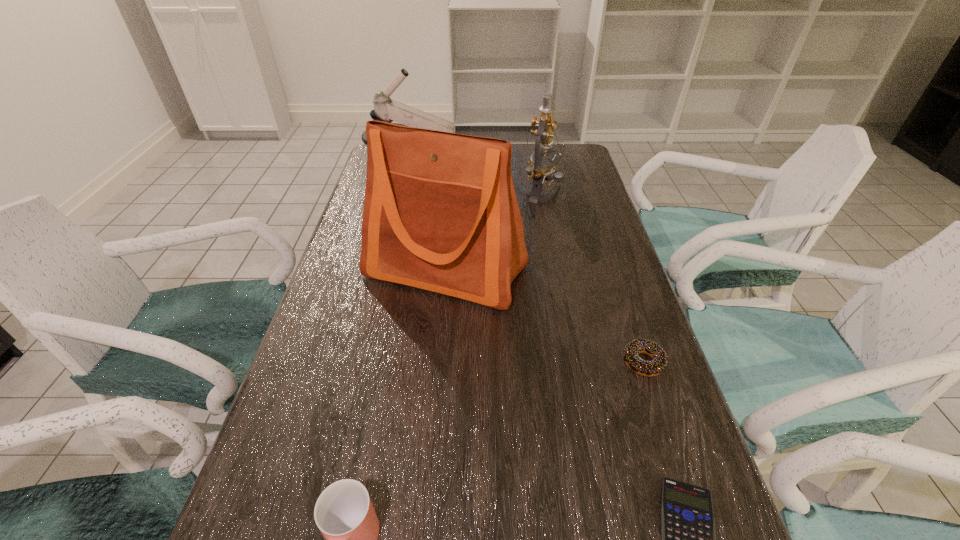
Find the location of a particular element. The image size is (960, 540). shopping bag located at the left edge is located at coordinates (440, 213).

Where is `microscope situated at the left edge`? The height and width of the screenshot is (540, 960). microscope situated at the left edge is located at coordinates 385,109.

Locate an element on the screen. microscope present at the right edge is located at coordinates 541,169.

Where is `doughnut situated at the right edge`? This screenshot has height=540, width=960. doughnut situated at the right edge is located at coordinates (658, 364).

Locate an element on the screen. The image size is (960, 540). object at the far left corner is located at coordinates (385, 109).

Where is `vacant space at the left edge`? vacant space at the left edge is located at coordinates [371, 368].

Image resolution: width=960 pixels, height=540 pixels. What are the coordinates of `vacant position at the right edge of the desktop` in the screenshot? It's located at (614, 232).

Identify the location of object that is the second closest one to the third farthest object. Image resolution: width=960 pixels, height=540 pixels. (658, 364).

Locate an element on the screen. The width and height of the screenshot is (960, 540). the closest object relative to the shopping bag is located at coordinates (541, 169).

At what (x,y) coordinates should I click in order to perform the action: click on vacant point that satisfies the following two spatial constraints: 1. on the front side of the right microscope; 2. on the right side of the fifth tallest object. Please return your answer as a coordinate pair (x, y). The height and width of the screenshot is (540, 960). Looking at the image, I should click on (577, 362).